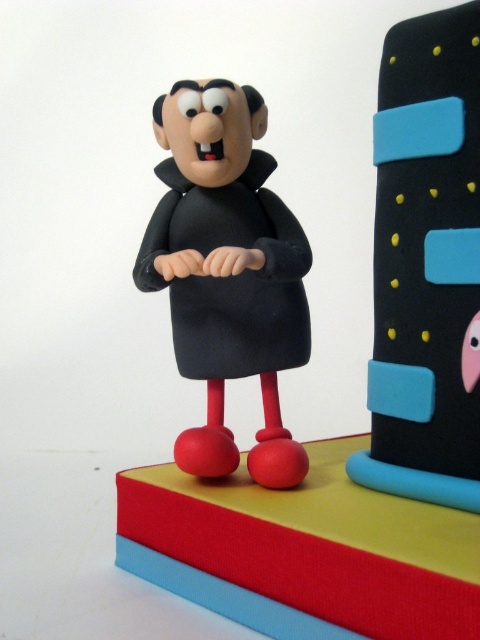
Question: Does matte black tower at upper right appear on the left side of matte black figurine at center?

Choices:
 (A) no
 (B) yes

Answer: (A)

Question: Does matte black tower at upper right appear over matte black figurine at center?

Choices:
 (A) no
 (B) yes

Answer: (B)

Question: Which of the following is the closest to the observer?

Choices:
 (A) matte black figurine at center
 (B) matte black tower at upper right

Answer: (B)

Question: Which of the following is the closest to the observer?

Choices:
 (A) (466, 49)
 (B) (283, 477)

Answer: (A)

Question: Can you confirm if matte black tower at upper right is positioned to the right of matte black figurine at center?

Choices:
 (A) yes
 (B) no

Answer: (A)